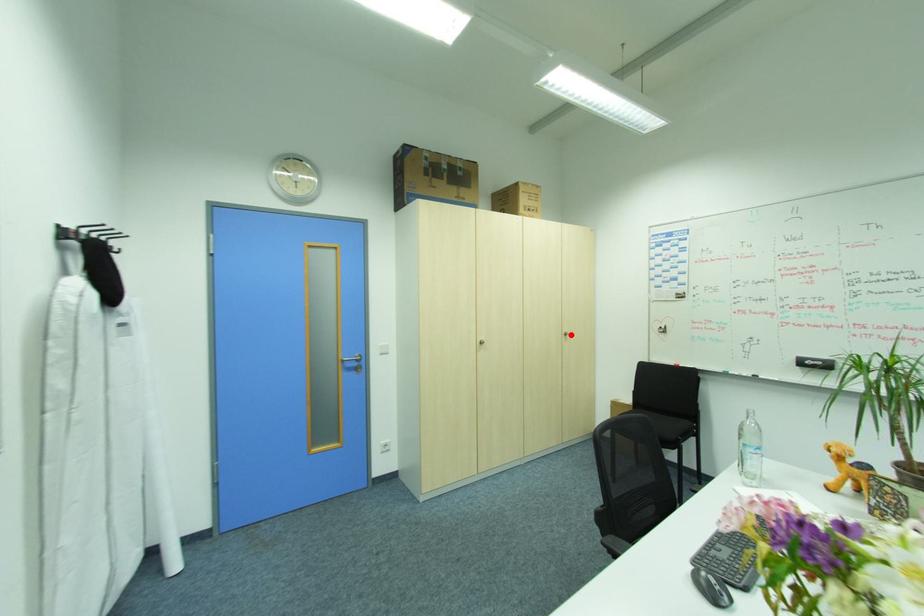
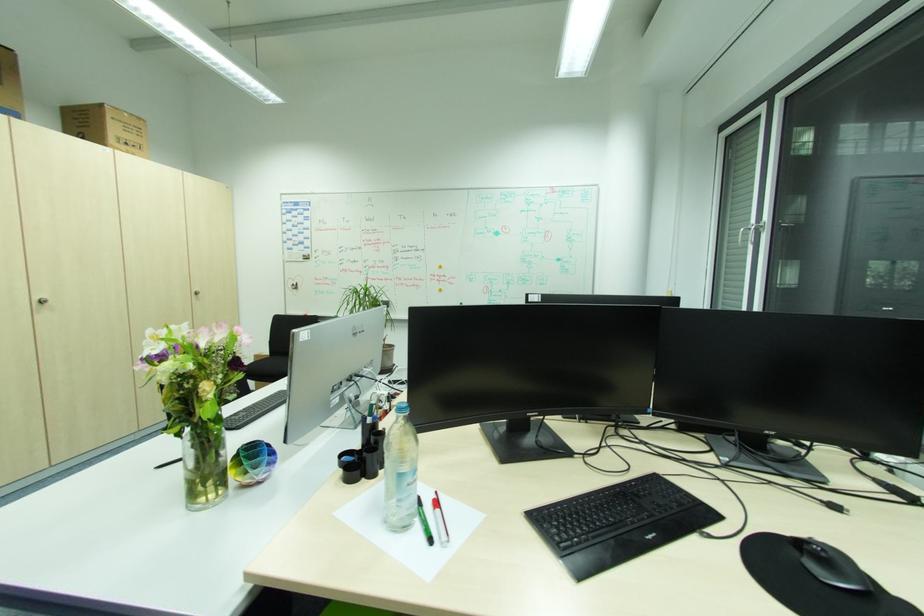
In the second image, find the point that corresponds to the highlighted location in the first image.

(202, 293)